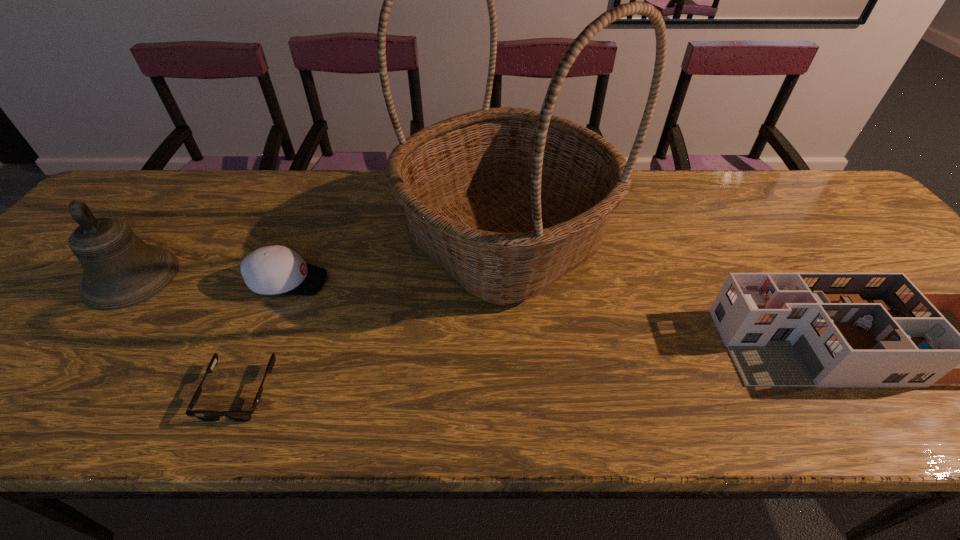
I want to click on free space between the shortest object and the second object from right to left, so click(x=372, y=315).

The height and width of the screenshot is (540, 960). In order to click on free space between the baseball cap and the leftmost object in this screenshot , I will do `click(210, 280)`.

What are the coordinates of `unoccupied position between the fourth tallest object and the sunglasses` in the screenshot? It's located at (264, 337).

Where is `object that is the second closest to the shortest object`? This screenshot has width=960, height=540. object that is the second closest to the shortest object is located at coordinates (507, 200).

Locate an element on the screen. The image size is (960, 540). object that is the third closest to the baseball cap is located at coordinates click(x=120, y=270).

You are a GUI agent. You are given a task and a screenshot of the screen. Output one action in this format:
    pyautogui.click(x=<x>, y=<y>)
    Task: Click on the vacant region that satisfies the following two spatial constraints: 1. on the front-facing side of the second shortest object; 2. on the temples of the sunglasses
    The image size is (960, 540).
    Given the screenshot: What is the action you would take?
    pyautogui.click(x=243, y=392)